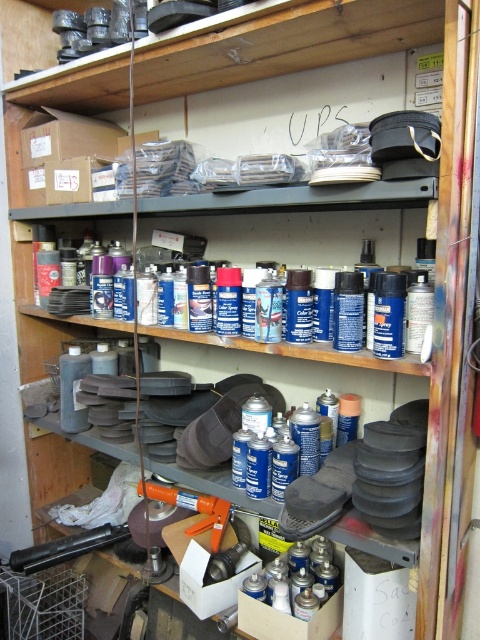
Can you confirm if blue matte spray cans at center is bigger than orange plastic caulking gun at center?

Yes.

Measure the distance between blue matte spray cans at center and orange plastic caulking gun at center.

They are 66.29 centimeters apart.

Who is more distant from viewer, (321,259) or (147,490)?

Positioned behind is point (147,490).

Locate an element on the screen. Image resolution: width=480 pixels, height=640 pixels. blue matte spray cans at center is located at coordinates (300, 234).